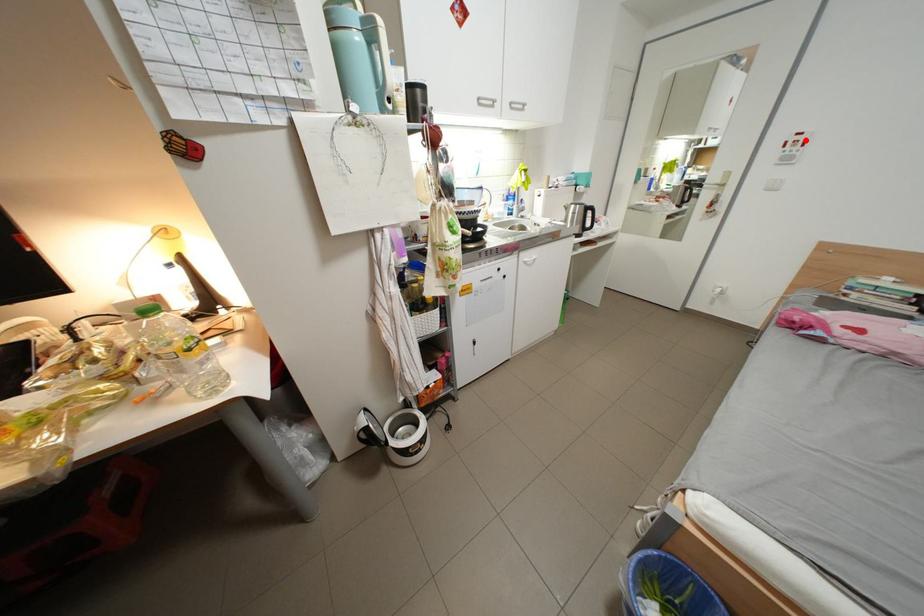
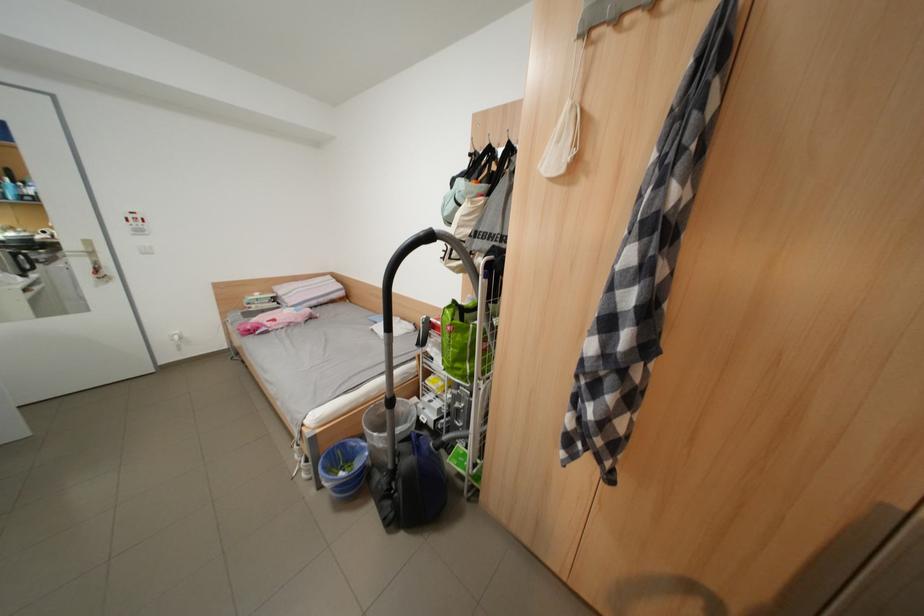
Locate, in the second image, the point that corresponds to the highlighted location in the first image.

(142, 217)